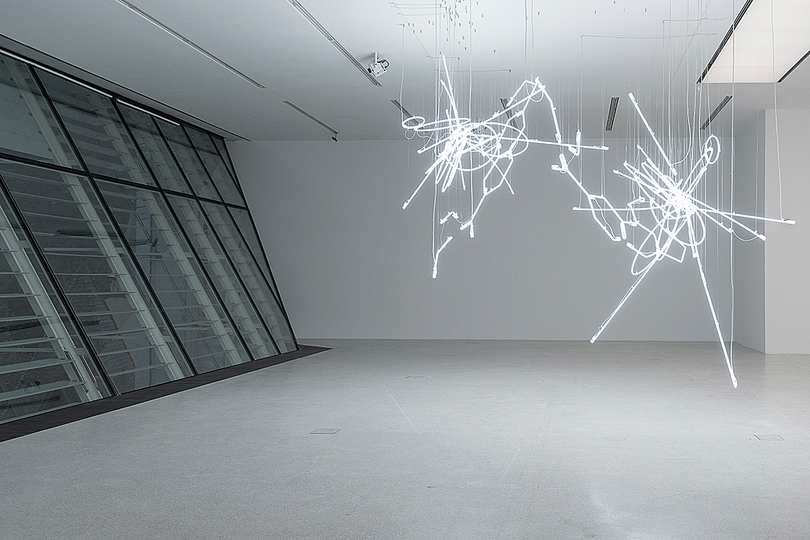
The height and width of the screenshot is (540, 810). Find the location of `light fixure cores`. light fixure cores is located at coordinates (681, 201), (461, 137).